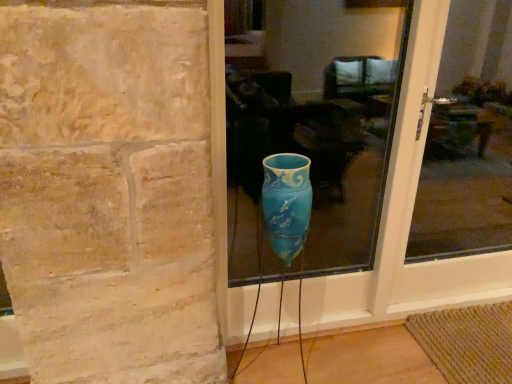
Question: In the image, is blue glass vase at center, marked as the 2th glass window in a right-to-left arrangement, positioned in front of or behind transparent glass door at center, the 2th glass window from the left?

Choices:
 (A) behind
 (B) front

Answer: (B)

Question: Is blue glass vase at center, marked as the 2th glass window in a right-to-left arrangement, wider or thinner than transparent glass door at center, the 2th glass window from the left?

Choices:
 (A) wide
 (B) thin

Answer: (A)

Question: Considering the positions of blue glass vase at center, the first glass window positioned from the left, and transparent glass door at center, the 2th glass window from the left, in the image, is blue glass vase at center, the first glass window positioned from the left, bigger or smaller than transparent glass door at center, the 2th glass window from the left,?

Choices:
 (A) small
 (B) big

Answer: (A)

Question: From the image's perspective, is transparent glass door at center, the 1th glass window when ordered from right to left, above or below blue glass vase at center, marked as the 2th glass window in a right-to-left arrangement?

Choices:
 (A) above
 (B) below

Answer: (B)

Question: Considering the positions of transparent glass door at center, the 1th glass window when ordered from right to left, and blue glass vase at center, marked as the 2th glass window in a right-to-left arrangement, in the image, is transparent glass door at center, the 1th glass window when ordered from right to left, wider or thinner than blue glass vase at center, marked as the 2th glass window in a right-to-left arrangement,?

Choices:
 (A) wide
 (B) thin

Answer: (B)

Question: Is transparent glass door at center, the 2th glass window from the left, taller or shorter than blue glass vase at center, the first glass window positioned from the left?

Choices:
 (A) short
 (B) tall

Answer: (B)

Question: Which is correct: transparent glass door at center, the 1th glass window when ordered from right to left, is inside blue glass vase at center, the first glass window positioned from the left, or outside of it?

Choices:
 (A) inside
 (B) outside

Answer: (B)